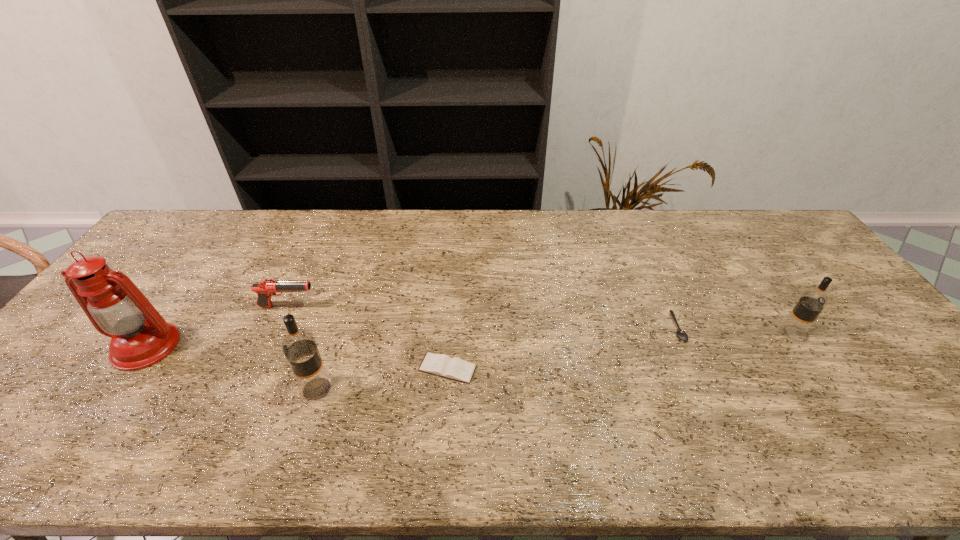
Where is `the fourth object from left to right`? The height and width of the screenshot is (540, 960). the fourth object from left to right is located at coordinates point(442,365).

Where is `the fifth tallest object`? Image resolution: width=960 pixels, height=540 pixels. the fifth tallest object is located at coordinates (442, 365).

Where is `vacant region located 0.220m on the label of the fifth shortest object`? The height and width of the screenshot is (540, 960). vacant region located 0.220m on the label of the fifth shortest object is located at coordinates (209, 389).

This screenshot has width=960, height=540. I want to click on vacant space situated on the label of the fifth shortest object, so click(180, 389).

Locate an element on the screen. The width and height of the screenshot is (960, 540). vacant space positioned on the label of the fifth shortest object is located at coordinates (180, 389).

Where is `blank space located 0.160m on the label of the shorter vodka`? blank space located 0.160m on the label of the shorter vodka is located at coordinates (862, 334).

At what (x,y) coordinates should I click in order to perform the action: click on free region located at the aiming end of the fifth object from right to left. Please return your answer as a coordinate pair (x, y). Image resolution: width=960 pixels, height=540 pixels. Looking at the image, I should click on (355, 306).

Where is `vacant position located on the back of the tallest object`? This screenshot has width=960, height=540. vacant position located on the back of the tallest object is located at coordinates pyautogui.click(x=203, y=267).

Identify the location of vacant space located 0.140m on the right of the soupspoon. (734, 328).

Where is `vacant area situated on the left of the diary`? The image size is (960, 540). vacant area situated on the left of the diary is located at coordinates (330, 368).